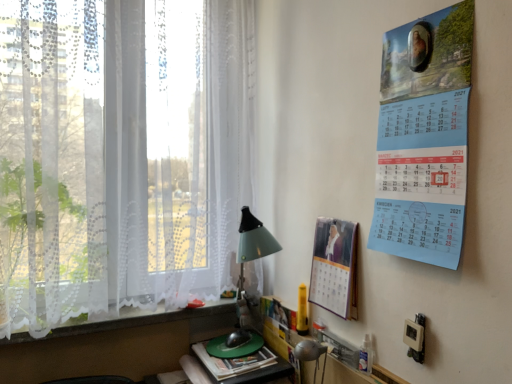
Question: From a real-world perspective, is matte paper calendar at right, marked as the second poster page in a right-to-left arrangement, on top of white lace at lower left?

Choices:
 (A) yes
 (B) no

Answer: (A)

Question: Can you confirm if matte paper calendar at right, marked as the 2th poster page in a top-to-bottom arrangement, is shorter than white lace at lower left?

Choices:
 (A) no
 (B) yes

Answer: (A)

Question: Is matte paper calendar at right, marked as the first poster page in a bottom-to-top arrangement, next to white lace at lower left?

Choices:
 (A) yes
 (B) no

Answer: (B)

Question: From the image's perspective, is matte paper calendar at right, marked as the second poster page in a right-to-left arrangement, located above white lace at lower left?

Choices:
 (A) no
 (B) yes

Answer: (B)

Question: Could you tell me if matte paper calendar at right, marked as the 2th poster page in a top-to-bottom arrangement, is facing white lace at lower left?

Choices:
 (A) yes
 (B) no

Answer: (B)

Question: Is white lace curtain at left inside the boundaries of matte green table lamp at lower center, or outside?

Choices:
 (A) outside
 (B) inside

Answer: (A)

Question: Considering their positions, is white lace curtain at left located in front of or behind matte green table lamp at lower center?

Choices:
 (A) behind
 (B) front

Answer: (B)

Question: From the image's perspective, is white lace curtain at left located above or below matte green table lamp at lower center?

Choices:
 (A) below
 (B) above

Answer: (B)

Question: From a real-world perspective, relative to matte green table lamp at lower center, is white lace curtain at left vertically above or below?

Choices:
 (A) below
 (B) above

Answer: (B)

Question: Is matte green table lamp at lower center to the left or to the right of white lace at lower left in the image?

Choices:
 (A) right
 (B) left

Answer: (A)

Question: Considering the positions of matte green table lamp at lower center and white lace at lower left in the image, is matte green table lamp at lower center bigger or smaller than white lace at lower left?

Choices:
 (A) big
 (B) small

Answer: (B)

Question: Considering the positions of matte green table lamp at lower center and white lace at lower left in the image, is matte green table lamp at lower center taller or shorter than white lace at lower left?

Choices:
 (A) tall
 (B) short

Answer: (A)

Question: From the image's perspective, is matte green table lamp at lower center above or below white lace at lower left?

Choices:
 (A) below
 (B) above

Answer: (A)

Question: Is matte green table lamp at lower center wider or thinner than matte paper calendar at right, which is counted as the second poster page, starting from the front?

Choices:
 (A) wide
 (B) thin

Answer: (A)

Question: Considering the positions of matte green table lamp at lower center and matte paper calendar at right, marked as the second poster page in a right-to-left arrangement, in the image, is matte green table lamp at lower center bigger or smaller than matte paper calendar at right, marked as the second poster page in a right-to-left arrangement,?

Choices:
 (A) small
 (B) big

Answer: (A)